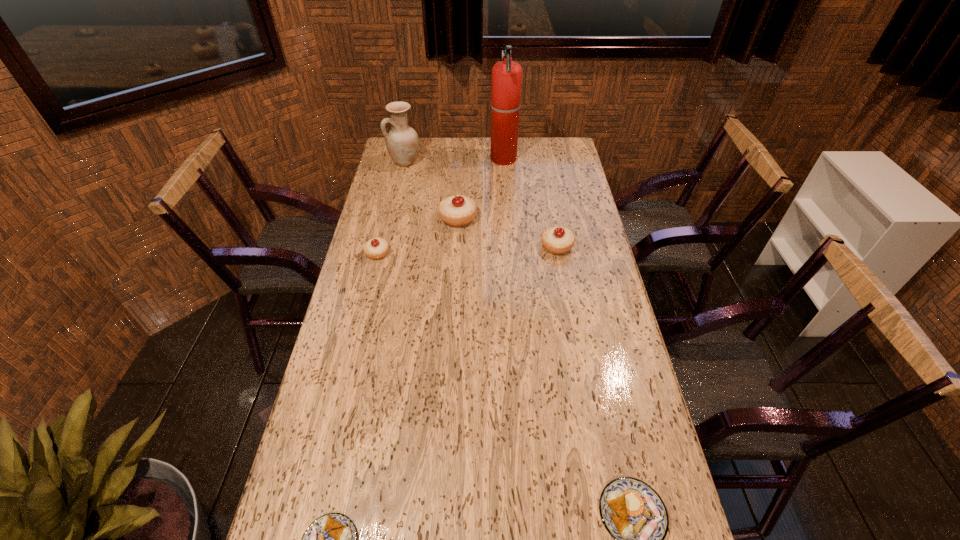
Locate an element on the screen. the third closest pastry to the left brown pastry is located at coordinates pyautogui.click(x=557, y=240).

Identify which beige pastry is located as the second nearest to the pottery. Please provide its 2D coordinates. Your answer should be formatted as a tuple, i.e. [(x, y)], where the tuple contains the x and y coordinates of a point satisfying the conditions above.

[(376, 248)]

Find the location of `the second closest beige pastry to the sixth shortest object`. the second closest beige pastry to the sixth shortest object is located at coordinates (376, 248).

Identify which brown pastry is the second nearest to the pottery. Please provide its 2D coordinates. Your answer should be formatted as a tuple, i.e. [(x, y)], where the tuple contains the x and y coordinates of a point satisfying the conditions above.

[(633, 513)]

Identify which brown pastry is the second closest to the pottery. Please provide its 2D coordinates. Your answer should be formatted as a tuple, i.e. [(x, y)], where the tuple contains the x and y coordinates of a point satisfying the conditions above.

[(633, 513)]

Locate an element on the screen. The height and width of the screenshot is (540, 960). vacant region that satisfies the following two spatial constraints: 1. with the nozzle and gauge on the tallest object; 2. on the back side of the fourth tallest object is located at coordinates (510, 246).

Locate an element on the screen. The width and height of the screenshot is (960, 540). vacant space that satisfies the following two spatial constraints: 1. with the nozzle and gauge on the fifth object from left to right; 2. on the right side of the fourth tallest object is located at coordinates (510, 246).